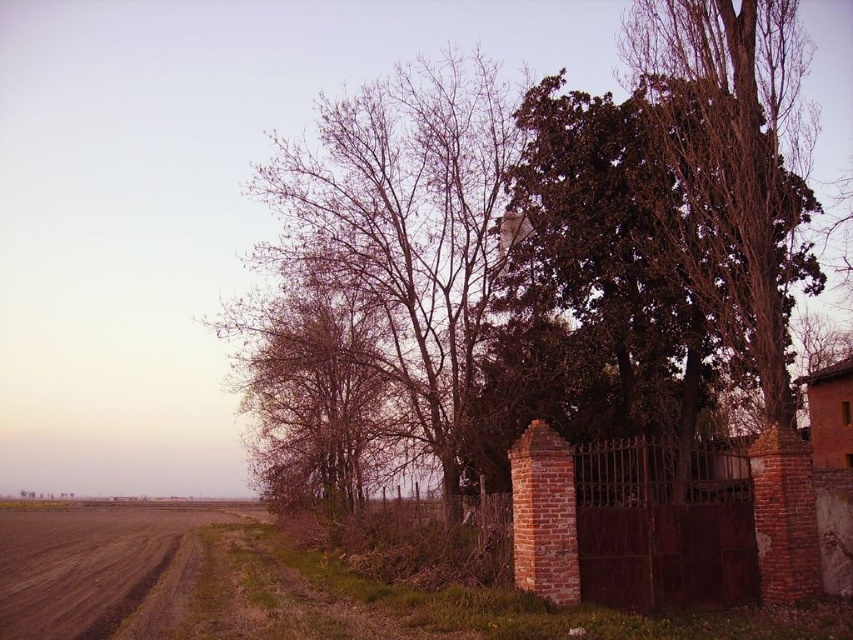
Question: Which point appears farthest from the camera in this image?

Choices:
 (A) (67, 556)
 (B) (358, 285)

Answer: (A)

Question: Which point appears closest to the camera in this image?

Choices:
 (A) (190, 586)
 (B) (486, 228)

Answer: (A)

Question: Does bare branches at center have a greater width compared to brown dirt track at lower left?

Choices:
 (A) no
 (B) yes

Answer: (A)

Question: Is bare branches at center bigger than brown dirt track at lower left?

Choices:
 (A) no
 (B) yes

Answer: (A)

Question: In this image, where is bare branches at center located relative to brown dirt track at lower left?

Choices:
 (A) right
 (B) left

Answer: (A)